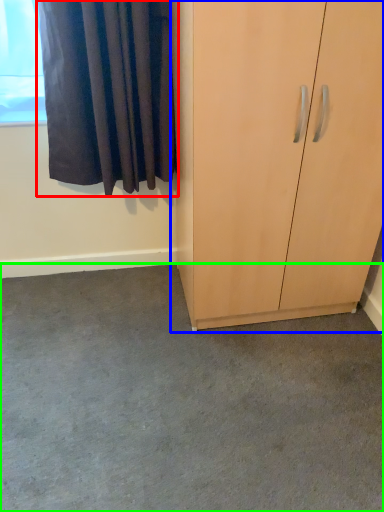
Question: Which is nearer to the curtain (highlighted by a red box)? cupboard (highlighted by a blue box) or concrete (highlighted by a green box).

Choices:
 (A) cupboard
 (B) concrete

Answer: (A)